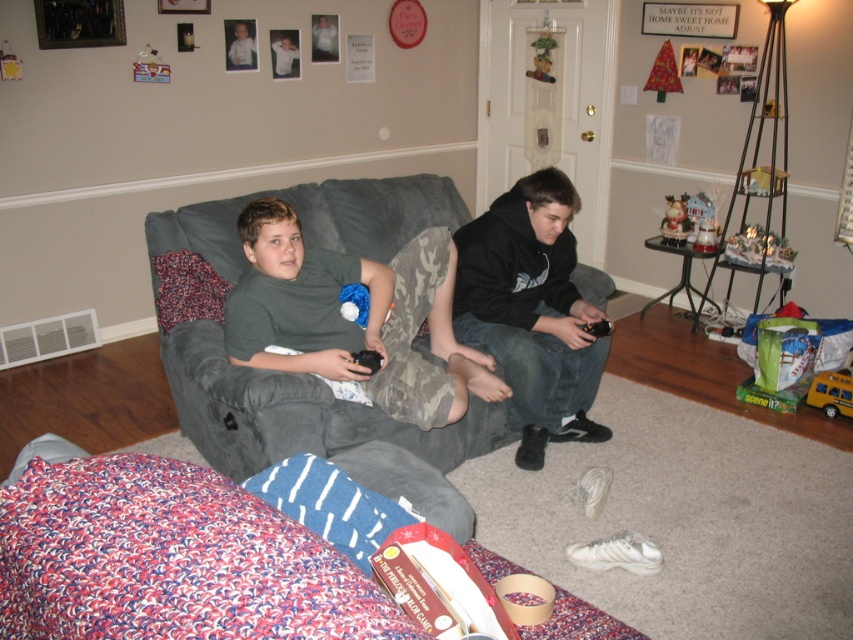
You are a delivery person who needs to place a small package between the gray fabric couch at center and the black matte hoodie at center. The package is 20 centimeters wide. Can you fit it in the space between them?

The gray fabric couch at center is 41.08 centimeters from the black matte hoodie at center. Since the package is 20 centimeters wide, which is less than the 41.08 centimeter gap, the package can fit between them.

You are standing in the living room and want to sit on the gray fabric couch at center. Where should you go to reach the point at coordinates point (300, 372)?

The point at coordinates point (300, 372) is located on the gray fabric couch at center, so you should go to the gray fabric couch at center to reach it.